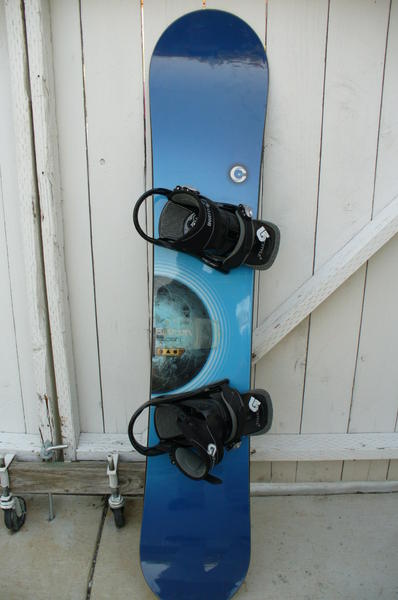
The height and width of the screenshot is (600, 398). In order to click on crack between tiles in this screenshot , I will do `click(95, 557)`.